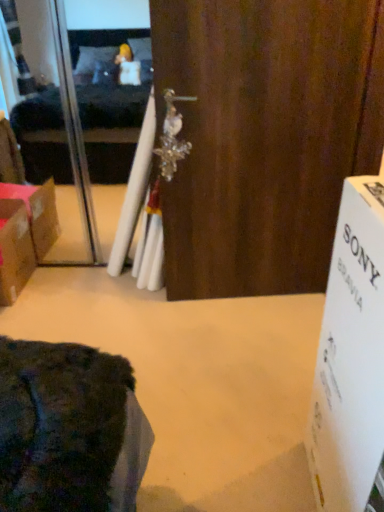
This screenshot has height=512, width=384. What do you see at coordinates (265, 136) in the screenshot?
I see `wooden door at center` at bounding box center [265, 136].

At what (x,y) coordinates should I click in order to perform the action: click on transparent plastic screen door at upper left. Please return your answer as a coordinate pair (x, y). This screenshot has height=512, width=384. Looking at the image, I should click on (73, 125).

Does white cardboard box at right turn towards brown cardboard box at left?

No.

Is white cardboard box at right wider than brown cardboard box at left?

No, white cardboard box at right is not wider than brown cardboard box at left.

Based on the photo, is the surface of white cardboard box at right in direct contact with brown cardboard box at left?

white cardboard box at right and brown cardboard box at left are not in contact.

Is white cardboard box at right touching transparent plastic screen door at upper left?

They are not placed beside each other.

Is white cardboard box at right wider than transparent plastic screen door at upper left?

Yes.

From the image's perspective, which one is positioned higher, white cardboard box at right or transparent plastic screen door at upper left?

transparent plastic screen door at upper left is shown above in the image.

This screenshot has height=512, width=384. I want to click on screen door on the left of white cardboard box at right, so click(x=73, y=125).

Looking at this image, would you say brown cardboard box at left is part of transparent plastic screen door at upper left's contents?

Definitely not — brown cardboard box at left is not inside transparent plastic screen door at upper left.

Looking at this image, from a real-world perspective, is transparent plastic screen door at upper left physically located above or below brown cardboard box at left?

From a real-world perspective, transparent plastic screen door at upper left is physically above brown cardboard box at left.

From the image's perspective, is transparent plastic screen door at upper left beneath brown cardboard box at left?

No, from the image's perspective, transparent plastic screen door at upper left is not beneath brown cardboard box at left.

Looking at this image, can you confirm if wooden door at center is thinner than white cardboard box at right?

Yes, wooden door at center is thinner than white cardboard box at right.

Which is farther from the camera, (314,206) or (332,270)?

Positioned behind is point (314,206).

Which object is further away from the camera taking this photo, wooden door at center or white cardboard box at right?

Positioned behind is wooden door at center.

From a real-world perspective, between wooden door at center and white cardboard box at right, who is vertically higher?

In real-world perspective, wooden door at center is above.

You are a GUI agent. You are given a task and a screenshot of the screen. Output one action in this format:
    pyautogui.click(x=<x>, y=<y>)
    Task: Click on the screen door positioned vertically above the white cardboard box at right (from a real-world perspective)
    The image size is (384, 512).
    Given the screenshot: What is the action you would take?
    pyautogui.click(x=73, y=125)

From a real-world perspective, is transparent plastic screen door at upper left on white cardboard box at right?

Yes, from a real-world perspective, transparent plastic screen door at upper left is over white cardboard box at right

From the image's perspective, which is below, transparent plastic screen door at upper left or white cardboard box at right?

From the image's view, white cardboard box at right is below.

Considering the sizes of transparent plastic screen door at upper left and white cardboard box at right in the image, is transparent plastic screen door at upper left taller or shorter than white cardboard box at right?

transparent plastic screen door at upper left is taller than white cardboard box at right.

You are a GUI agent. You are given a task and a screenshot of the screen. Output one action in this format:
    pyautogui.click(x=<x>, y=<y>)
    Task: Click on the screen door on the right side of brown cardboard box at left
    This screenshot has width=384, height=512.
    Given the screenshot: What is the action you would take?
    pyautogui.click(x=73, y=125)

Does brown cardboard box at left have a larger size compared to transparent plastic screen door at upper left?

Incorrect, brown cardboard box at left is not larger than transparent plastic screen door at upper left.

Considering the relative sizes of brown cardboard box at left and transparent plastic screen door at upper left in the image provided, is brown cardboard box at left shorter than transparent plastic screen door at upper left?

Yes.

From a real-world perspective, which is physically below, brown cardboard box at left or transparent plastic screen door at upper left?

brown cardboard box at left is physically lower.

Does white cardboard box at right have a greater height compared to wooden door at center?

Incorrect, the height of white cardboard box at right is not larger of that of wooden door at center.

From a real-world perspective, who is located lower, white cardboard box at right or wooden door at center?

white cardboard box at right, from a real-world perspective.

Is white cardboard box at right at the right side of wooden door at center?

Yes, white cardboard box at right is to the right of wooden door at center.

How different are the orientations of white cardboard box at right and wooden door at center in degrees?

The facing directions of white cardboard box at right and wooden door at center are 96.7 degrees apart.

At what (x,y) coordinates should I click in order to perform the action: click on cardboard box that is below the brown cardboard box at left (from the image's perspective). Please return your answer as a coordinate pair (x, y). The height and width of the screenshot is (512, 384). Looking at the image, I should click on (351, 359).

At what (x,y) coordinates should I click in order to perform the action: click on screen door on the left of white cardboard box at right. Please return your answer as a coordinate pair (x, y). Image resolution: width=384 pixels, height=512 pixels. Looking at the image, I should click on (73, 125).

Considering their positions, is brown cardboard box at left positioned further to white cardboard box at right than wooden door at center?

brown cardboard box at left.

Which object lies nearer to the anchor point wooden door at center, white cardboard box at right or transparent plastic screen door at upper left?

transparent plastic screen door at upper left is closer to wooden door at center.

When comparing their distances from brown cardboard box at left, does wooden door at center or transparent plastic screen door at upper left seem closer?

Based on the image, transparent plastic screen door at upper left appears to be nearer to brown cardboard box at left.

Estimate the real-world distances between objects in this image. Which object is closer to transparent plastic screen door at upper left, white cardboard box at right or wooden door at center?

wooden door at center is closer to transparent plastic screen door at upper left.

Based on the photo, estimate the real-world distances between objects in this image. Which object is closer to brown cardboard box at left, transparent plastic screen door at upper left or wooden door at center?

transparent plastic screen door at upper left is positioned closer to the anchor brown cardboard box at left.

Looking at the image, which one is located further to white cardboard box at right, transparent plastic screen door at upper left or wooden door at center?

Based on the image, transparent plastic screen door at upper left appears to be further to white cardboard box at right.

When comparing their distances from white cardboard box at right, does brown cardboard box at left or transparent plastic screen door at upper left seem closer?

Based on the image, brown cardboard box at left appears to be nearer to white cardboard box at right.

From the image, which object appears to be farther from white cardboard box at right, transparent plastic screen door at upper left or brown cardboard box at left?

transparent plastic screen door at upper left lies further to white cardboard box at right than the other object.

Find the location of a particular element. The height and width of the screenshot is (512, 384). box between white cardboard box at right and transparent plastic screen door at upper left along the z-axis is located at coordinates (15, 250).

The image size is (384, 512). Find the location of `door between brown cardboard box at left and white cardboard box at right from left to right`. door between brown cardboard box at left and white cardboard box at right from left to right is located at coordinates (265, 136).

At what (x,y) coordinates should I click in order to perform the action: click on screen door located between brown cardboard box at left and wooden door at center in the left-right direction. Please return your answer as a coordinate pair (x, y). Looking at the image, I should click on (73, 125).

Identify the location of door between white cardboard box at right and transparent plastic screen door at upper left along the z-axis. (265, 136).